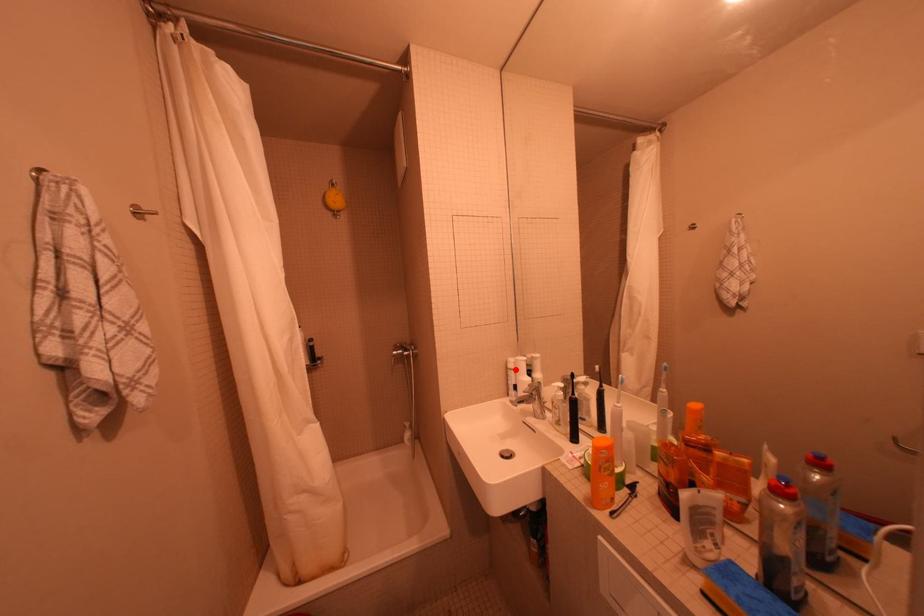
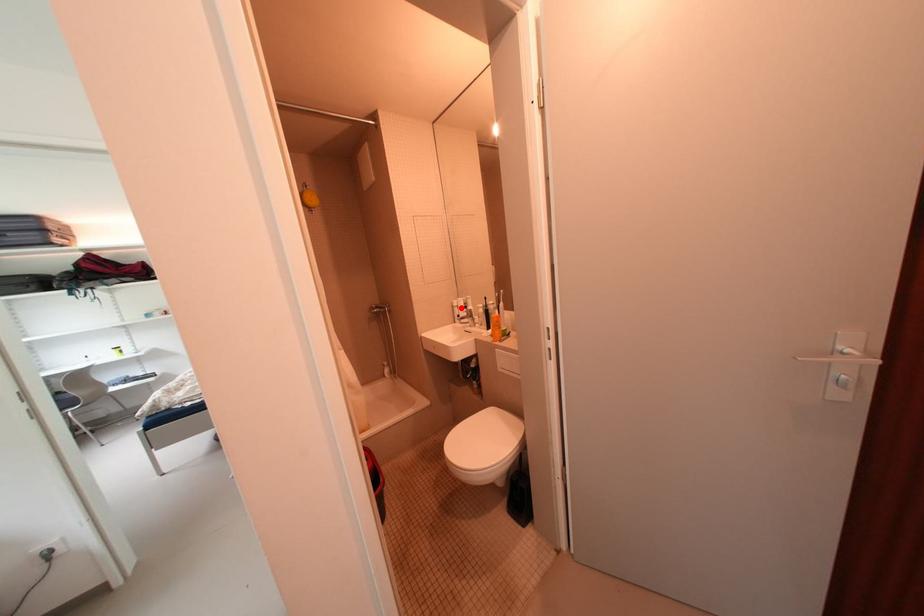
Consider the image. I am providing you with two images of the same scene from different viewpoints. A red point is marked on the first image and another point is marked on the second image. Is the marked point in image1 the same physical position as the marked point in image2?

Yes